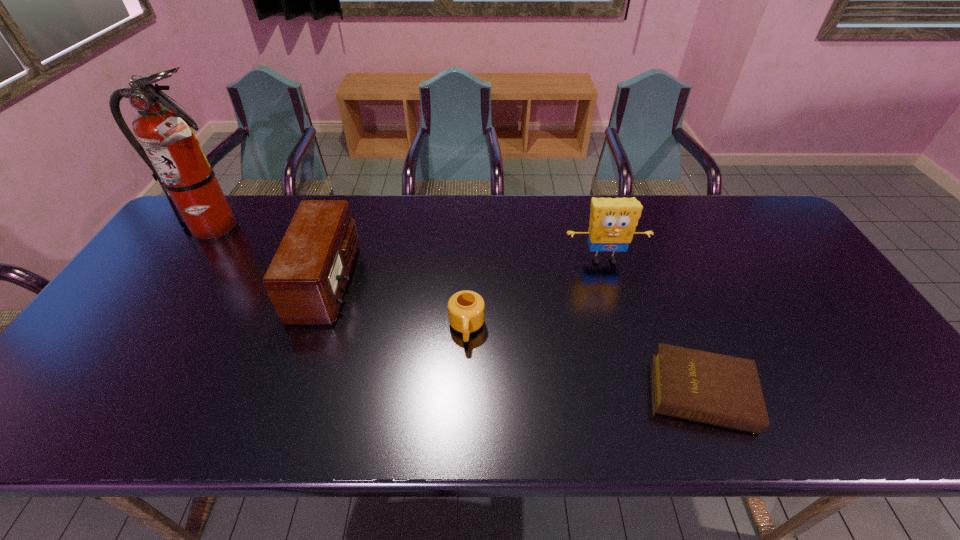
Where is `the leftmost object`? The height and width of the screenshot is (540, 960). the leftmost object is located at coordinates (170, 148).

Locate an element on the screen. the tallest object is located at coordinates (170, 148).

Find the location of a particular element. The width and height of the screenshot is (960, 540). sponge is located at coordinates (613, 221).

Locate an element on the screen. This screenshot has height=540, width=960. the second object from left to right is located at coordinates (306, 280).

The height and width of the screenshot is (540, 960). In order to click on the third tallest object in this screenshot , I will do `click(306, 280)`.

The width and height of the screenshot is (960, 540). Find the location of `the fourth tallest object`. the fourth tallest object is located at coordinates (466, 309).

Where is `mug`? This screenshot has width=960, height=540. mug is located at coordinates (466, 309).

Locate an element on the screen. the shortest object is located at coordinates (721, 390).

You are a GUI agent. You are given a task and a screenshot of the screen. Output one action in this format:
    pyautogui.click(x=<x>, y=<y>)
    Task: Click on the nearest object
    The width and height of the screenshot is (960, 540).
    Given the screenshot: What is the action you would take?
    pyautogui.click(x=721, y=390)

Identify the location of free space located 0.050m from the nozzle of the fire extinguisher. This screenshot has height=540, width=960. (191, 260).